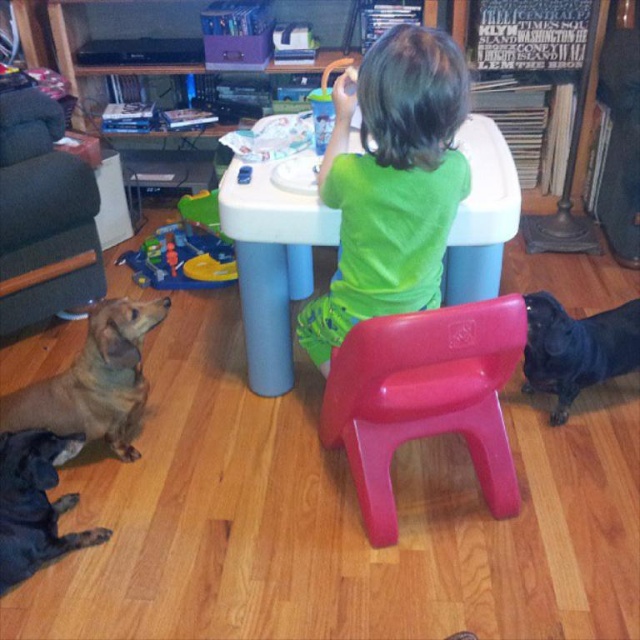
You are a parent trying to place a new dog bed in the living room. The bed is 1 meter wide. You see the brown fur dog at lower left and the black glossy dog at lower right. Which dog would the bed fit better for?

The brown fur dog at lower left has a larger width than the black glossy dog at lower right, so the 1 meter wide bed would fit better for the brown fur dog at lower left.

You are a parent trying to find your child who is wearing a green matte shirt at center. You see a red plastic stool at center in the room. Where would you look for the child?

The green matte shirt at center is positioned over the red plastic stool at center, so the child wearing the green matte shirt at center is sitting on the red plastic stool at center.

From the picture: You are a parent trying to place a red plastic stool at center in the room. The room has a coordinate system where the bottom left corner is the origin. Where should you place it?

You should place the red plastic stool at center at the coordinate point of (424,397).